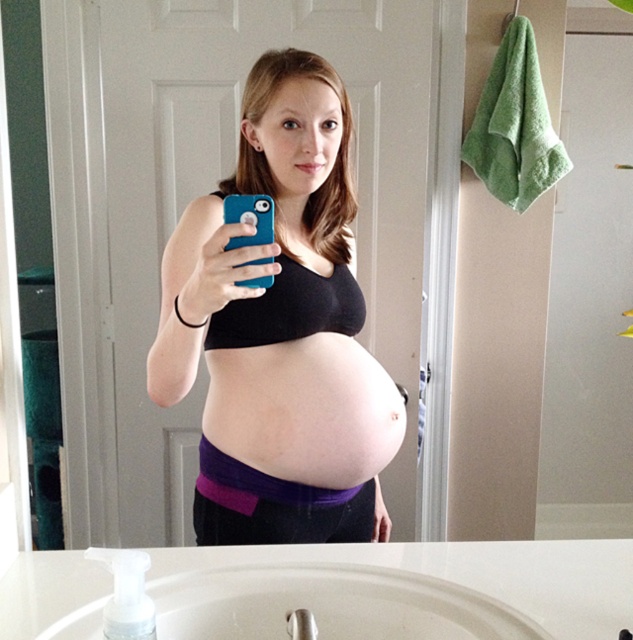
You are a fashion designer who wants to create a new outfit using the matte black tank top at center and the pink fabric at center. How far apart are these two items in the image?

The matte black tank top at center and the pink fabric at center are 2.83 inches apart.

You are a fashion stylist analyzing the outfit of the person in the image. The person is wearing a matte black tank top at center and a pink fabric at center. Which clothing item is higher on the body?

The matte black tank top at center is taller than the pink fabric at center, so the matte black tank top at center is higher on the body.

You are a fashion designer observing the image. You need to determine which item is taller between the matte black tank top at center and the white ceramic sink at lower center. Which one is taller?

The matte black tank top at center is taller than the white ceramic sink at lower center according to the description.